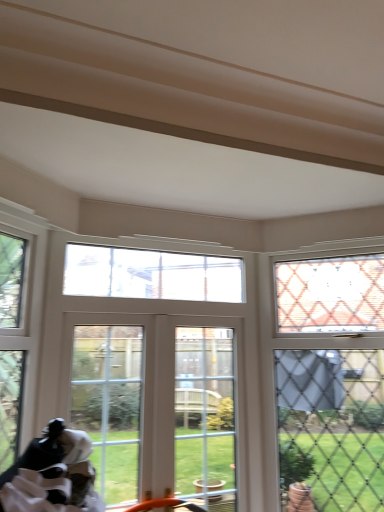
The image size is (384, 512). What are the coordinates of `empty space that is ontop of white glass door at center (from a real-world perspective)` in the screenshot? It's located at (207, 315).